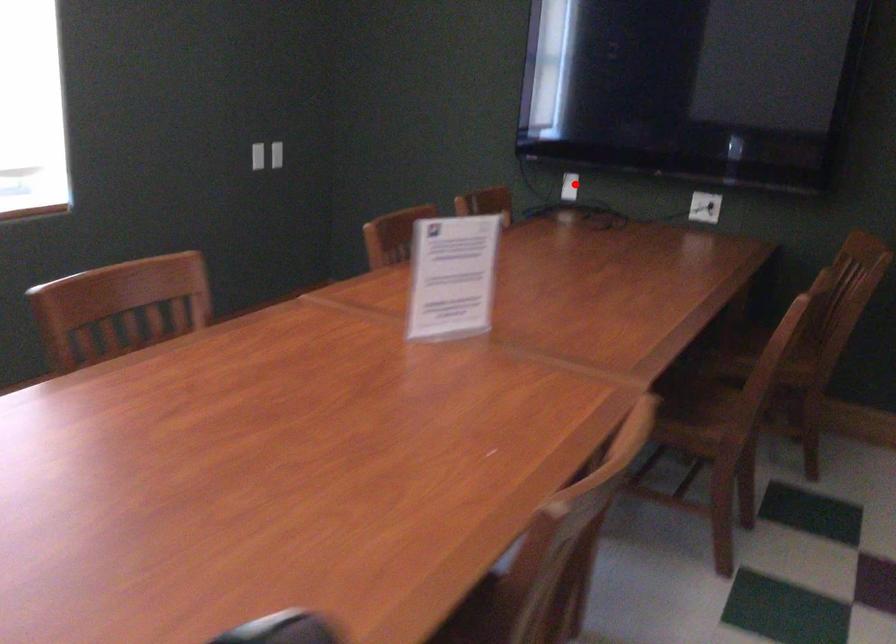
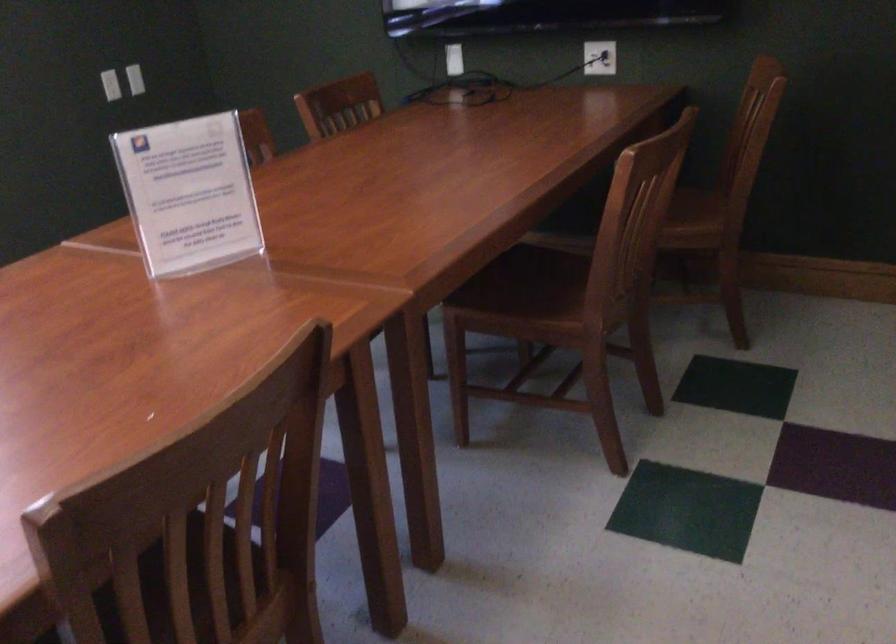
Question: I am providing you with two images of the same scene from different viewpoints. A red point is marked on the first image. Is the red point's position out of view in image 2?

Choices:
 (A) Yes
 (B) No

Answer: (B)